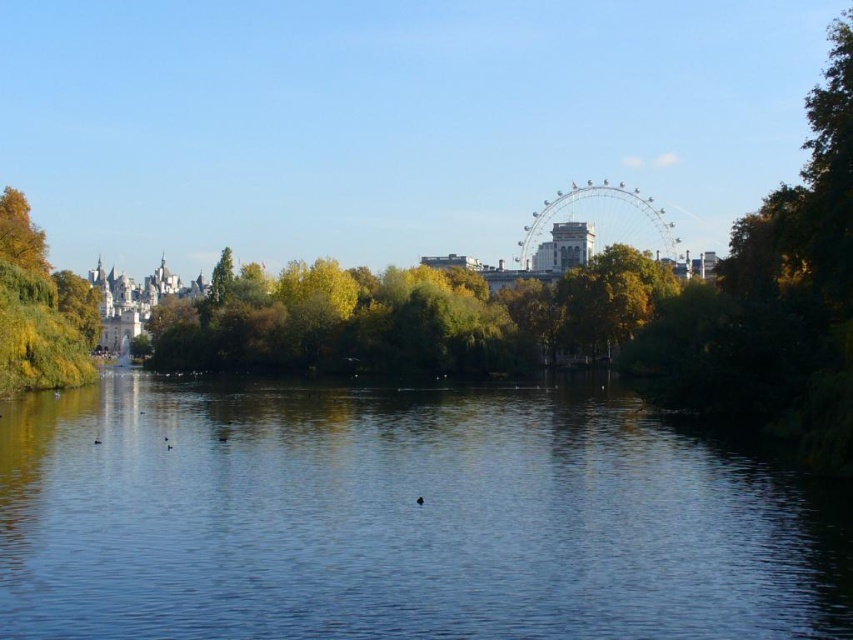
You are a photographer planning to take a landscape photo of the green leafy tree at left and the brown fuzzy duck at center. Given that you want both subjects to be clearly visible in the frame, which subject should you focus on first to ensure depth of field captures both effectively?

You should focus on the brown fuzzy duck at center first because it is closer to the camera than the green leafy tree at left, ensuring both are in focus when using depth of field techniques.

You are standing at the riverside and want to cross the river using a small wooden bridge. The bridge is exactly as wide as the transparent water at center. Can you walk from the green leafy tree at left to the other side without stepping into the water?

The transparent water at center might be wider than green leafy tree at left, so the bridge may not be wide enough to reach the other side safely. You might step into the water.